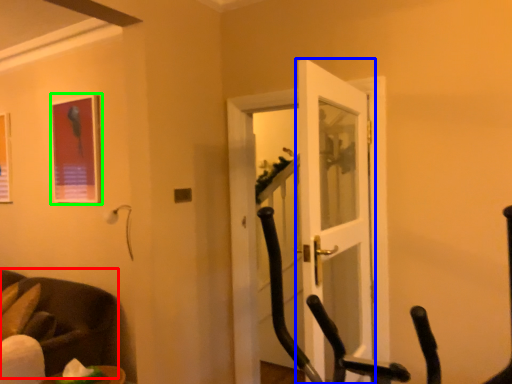
Question: Based on their relative distances, which object is farther from chair (highlighted by a red box)? Choose from door (highlighted by a blue box) and picture frame (highlighted by a green box).

Choices:
 (A) door
 (B) picture frame

Answer: (A)